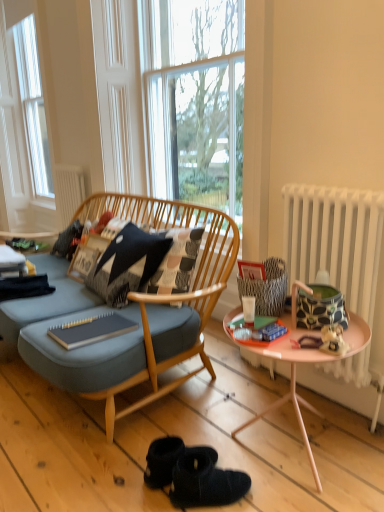
Find the location of `free space to the right of white glossy cup at center`. free space to the right of white glossy cup at center is located at coordinates point(302,333).